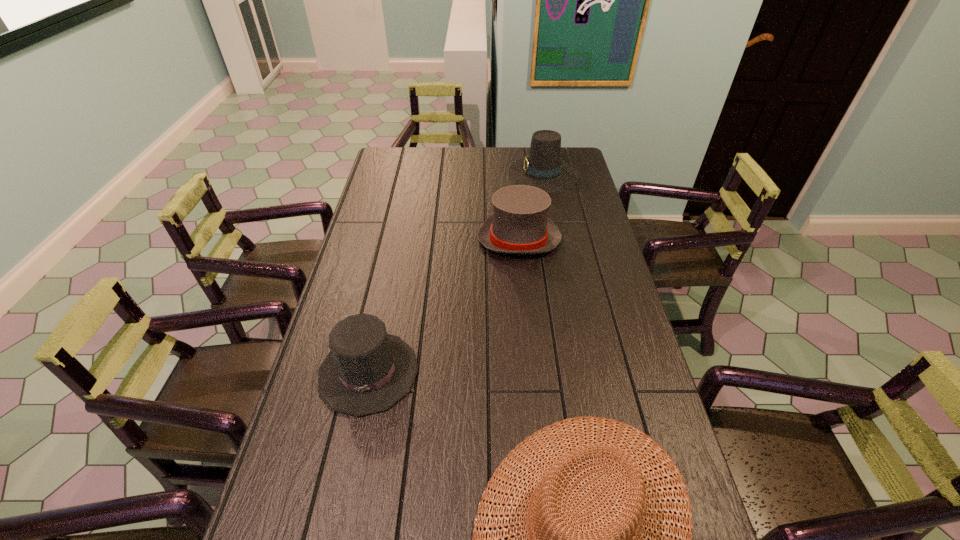
Locate an element on the screen. This screenshot has width=960, height=540. the farthest object is located at coordinates (543, 168).

Where is `the second farthest object`? The image size is (960, 540). the second farthest object is located at coordinates (519, 224).

Where is `the leftmost object`? The width and height of the screenshot is (960, 540). the leftmost object is located at coordinates (367, 371).

This screenshot has width=960, height=540. Identify the location of the nearest dress hat. (367, 371).

The height and width of the screenshot is (540, 960). In order to click on vacant space located on the front-facing side of the farthest object in this screenshot , I will do `click(438, 174)`.

Locate an element on the screen. Image resolution: width=960 pixels, height=540 pixels. free space located 0.090m on the front-facing side of the farthest object is located at coordinates (488, 174).

Identify the location of vacant area situated 0.190m on the front-facing side of the farthest object. (466, 174).

Locate an element on the screen. The image size is (960, 540). free space located on the left of the second nearest dress hat is located at coordinates (376, 239).

Where is `vacant area situated 0.210m on the front of the nearest dress hat with the decoration`? The height and width of the screenshot is (540, 960). vacant area situated 0.210m on the front of the nearest dress hat with the decoration is located at coordinates (340, 507).

Where is `object that is at the far edge`? object that is at the far edge is located at coordinates (543, 168).